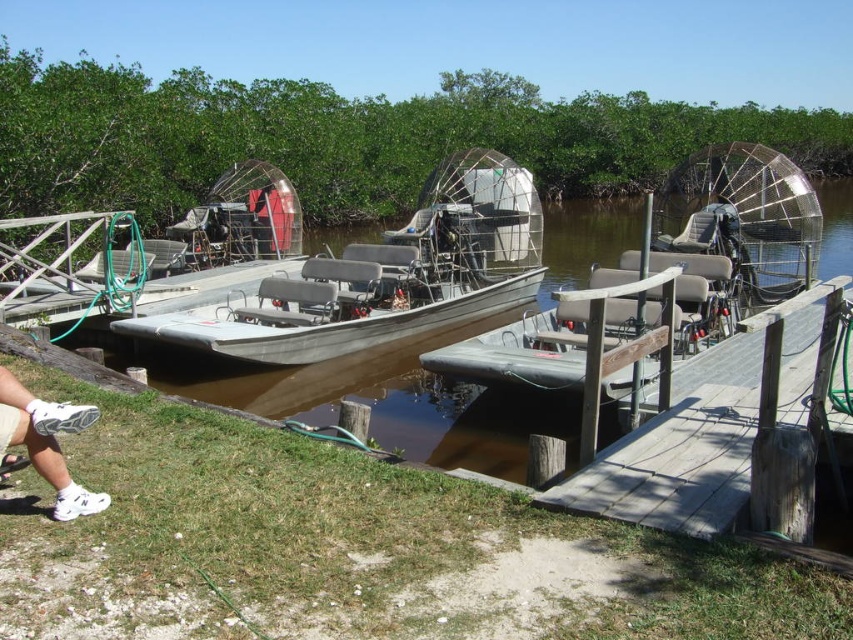
You are a tour guide preparing to board passengers. You have two boats available for today, the gray metallic boat at center and the silver metallic airboat at center. Which boat has more vertical space for standing passengers?

The gray metallic boat at center has a greater height compared to the silver metallic airboat at center, so it provides more vertical space for standing passengers.

You are standing on the dock and want to board the gray metallic boat at center and the silver metallic airboat at center. Which one do you need to walk towards first?

You need to walk towards the gray metallic boat at center first because it is closer to you than the silver metallic airboat at center.